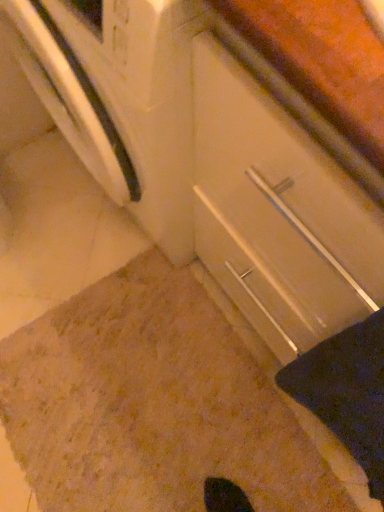
What are the coordinates of `free space above brown textured carpet at lower center (from a real-world perspective)` in the screenshot? It's located at (151, 412).